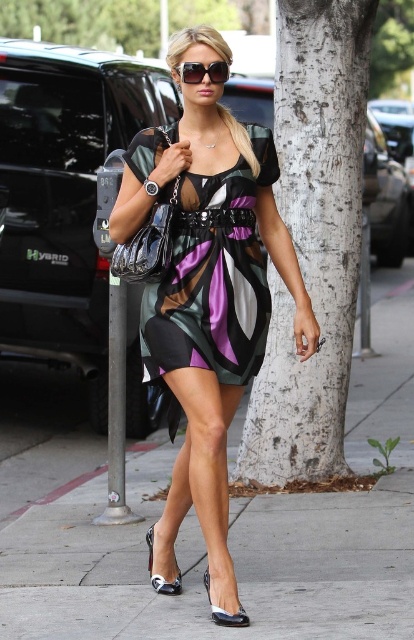
Identify the location of white bark tree at upper center. (86, 22).

Is white bark tree at upper center smaller than shiny black sandal at lower center?

No.

Find the location of a particular element. white bark tree at upper center is located at coordinates 86,22.

Where is `metallic gray pole at lower left`? The image size is (414, 640). metallic gray pole at lower left is located at coordinates tap(117, 410).

Can you confirm if metallic gray pole at lower left is positioned to the right of shiny patent leather sandal at lower center?

In fact, metallic gray pole at lower left is to the left of shiny patent leather sandal at lower center.

Locate an element on the screen. metallic gray pole at lower left is located at coordinates (117, 410).

Where is `metallic gray pole at lower left`? The width and height of the screenshot is (414, 640). metallic gray pole at lower left is located at coordinates (117, 410).

Is smooth concrete sidewalk at center taller than shiny black sandal at lower center?

Indeed, smooth concrete sidewalk at center has a greater height compared to shiny black sandal at lower center.

Is smooth concrete sidewalk at center positioned at the back of shiny black sandal at lower center?

No, smooth concrete sidewalk at center is in front of shiny black sandal at lower center.

Locate an element on the screen. This screenshot has height=640, width=414. smooth concrete sidewalk at center is located at coordinates (230, 528).

Locate an element on the screen. Image resolution: width=414 pixels, height=640 pixels. smooth concrete sidewalk at center is located at coordinates point(230,528).